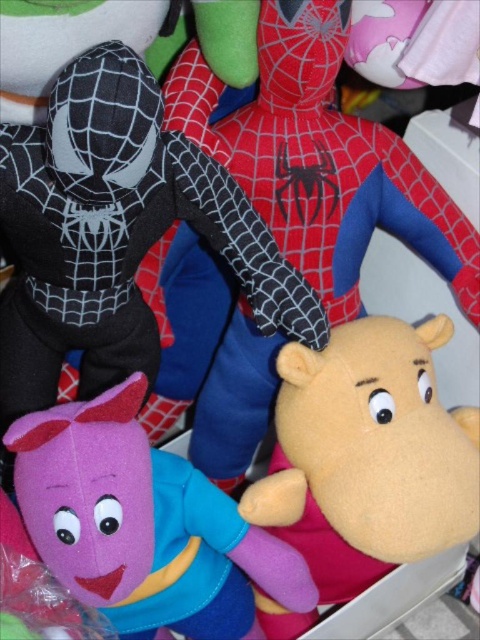
You are organizing a toy store and need to place the velvet yellow plush hippo at center and the soft yellow hippo at center on a shelf. Which hippo should you place on the lower shelf to ensure they are both visible?

The soft yellow hippo at center should be placed on the lower shelf because it is shorter than the velvet yellow plush hippo at center, allowing both to be visible when placed accordingly.

You are a photographer trying to capture a closeup of the velvet yellow plush hippo at center. Your camera has a minimum focusing distance of 70 centimeters. Will you be able to take the photo without moving the camera closer?

The distance between the velvet yellow plush hippo at center and the camera is 75.76 centimeters, which is greater than the camera minimum focusing distance of 70 centimeters. Therefore, you can take the photo without moving the camera closer.

You are a child trying to reach the velvet yellow plush hippo at center from the matte purple plush toy at lower left. Can you grab it without moving the purple plush toy?

The velvet yellow plush hippo at center is positioned over the matte purple plush toy at lower left, so you can grab it without moving the purple plush toy because it is already on top.